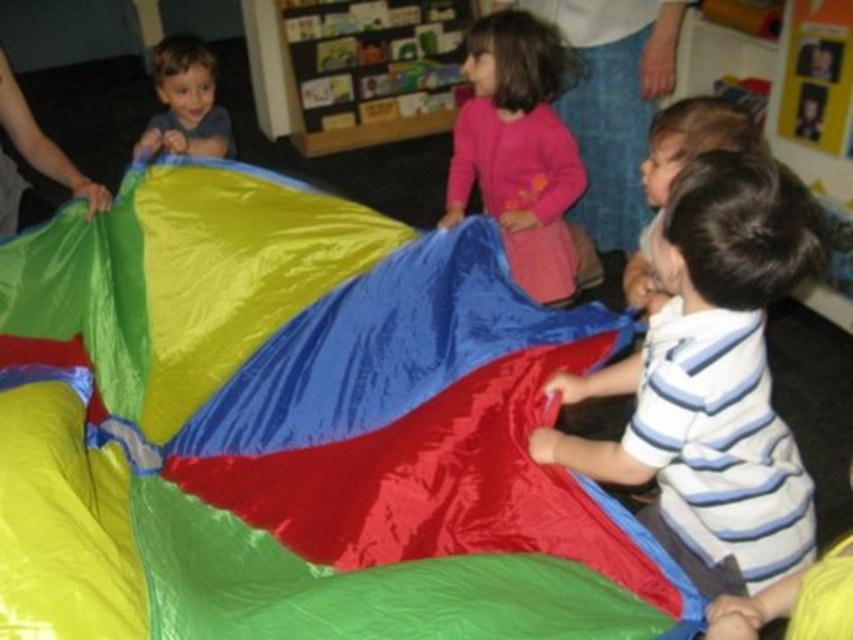
Where is the shiny plastic kite at center located in the image?

The shiny plastic kite at center is located at point coordinates of (294, 428).

You are a teacher in the classroom and want to ensure that the striped cotton shirt at lower right and the pink fabric at center are within a safe distance of at least 1 meter apart for safety during the activity. Based on the scene, are they within the required distance?

The distance between the striped cotton shirt at lower right and the pink fabric at center is 1.18 meters, which exceeds the minimum required 1 meter safety distance. Therefore, they are within the safe distance requirement.

You are a teacher in the classroom and you want to hang the shiny plastic kite at center and the striped cotton shirt at lower right on a wall. Which object should you hang higher to ensure both are visible without overlapping?

The shiny plastic kite at center is bigger than the striped cotton shirt at lower right, so you should hang the shiny plastic kite at center higher to ensure both are visible without overlapping.